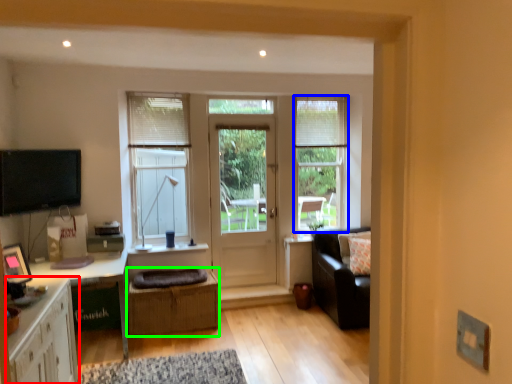
Question: Considering the real-world distances, which object is farthest from cabinetry (highlighted by a red box)? window (highlighted by a blue box) or crate (highlighted by a green box)?

Choices:
 (A) window
 (B) crate

Answer: (A)